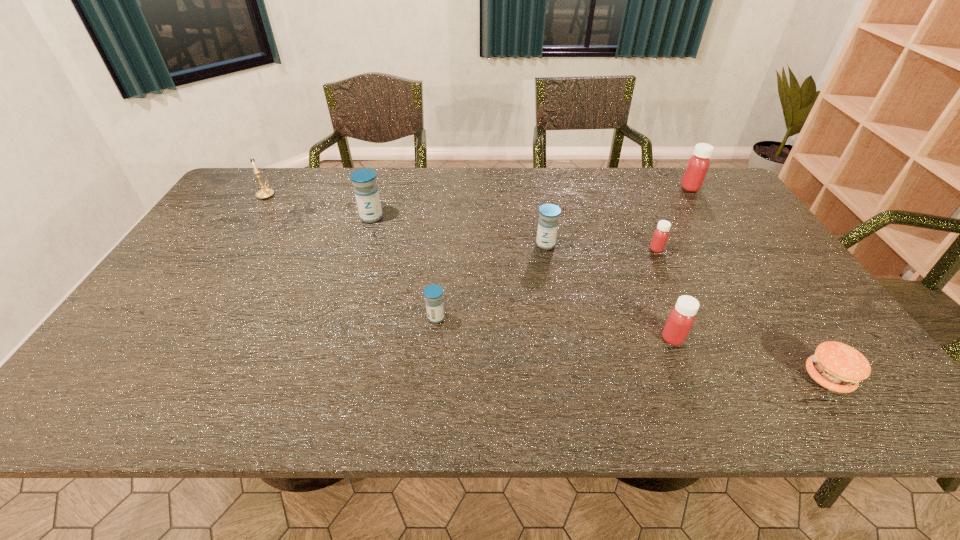
The width and height of the screenshot is (960, 540). What are the coordinates of `free spot located on the back of the rightmost blue medicine` in the screenshot? It's located at (540, 209).

Find the location of a particular element. vacant space located on the left of the nearest red medicine is located at coordinates click(x=623, y=338).

Where is `vacant position located on the back of the third object from right to left`? The height and width of the screenshot is (540, 960). vacant position located on the back of the third object from right to left is located at coordinates (635, 202).

Where is `free spot located 0.220m on the right of the second nearest medicine`? Image resolution: width=960 pixels, height=540 pixels. free spot located 0.220m on the right of the second nearest medicine is located at coordinates (536, 318).

Where is `vacant space located 0.260m on the left of the nearest object`? This screenshot has height=540, width=960. vacant space located 0.260m on the left of the nearest object is located at coordinates (684, 377).

The height and width of the screenshot is (540, 960). I want to click on medicine that is at the far edge, so click(698, 164).

At what (x,y) coordinates should I click in order to perform the action: click on candle holder at the far edge. Please return your answer as a coordinate pair (x, y). The image size is (960, 540). Looking at the image, I should click on (265, 193).

Locate an element on the screen. The width and height of the screenshot is (960, 540). object that is positioned at the near edge is located at coordinates (838, 367).

This screenshot has height=540, width=960. Find the location of `object that is at the left edge`. object that is at the left edge is located at coordinates (265, 193).

You are a GUI agent. You are given a task and a screenshot of the screen. Output one action in this format:
    pyautogui.click(x=<x>, y=<y>)
    Task: Click on the medicine that is at the right edge
    
    Given the screenshot: What is the action you would take?
    pyautogui.click(x=698, y=164)